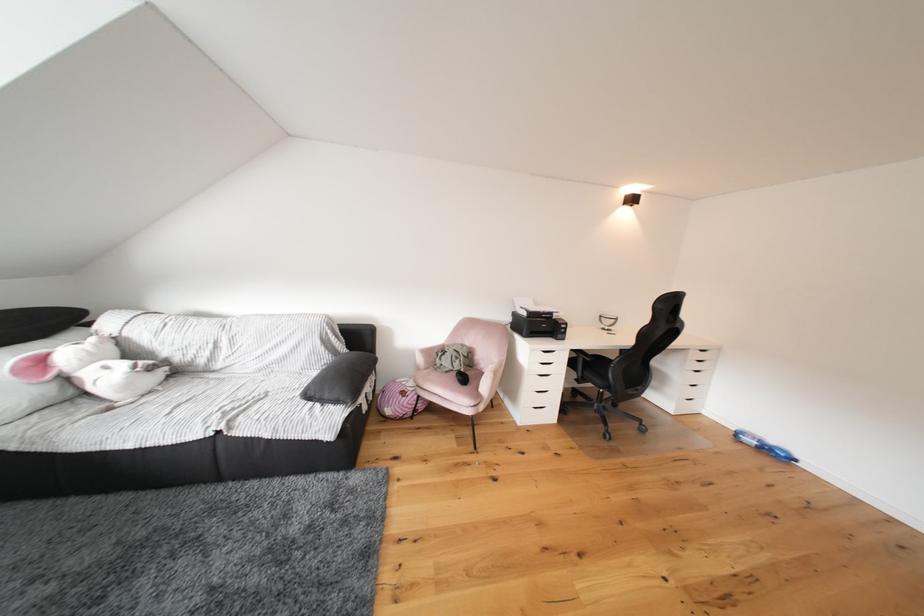
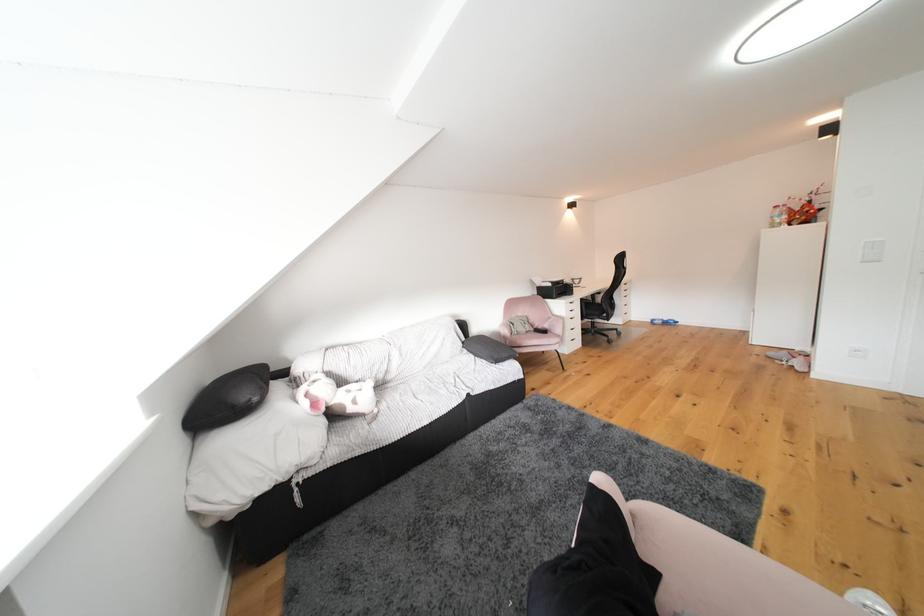
Locate, in the second image, the point that corresponds to the point at 561,317 in the first image.

(572, 285)